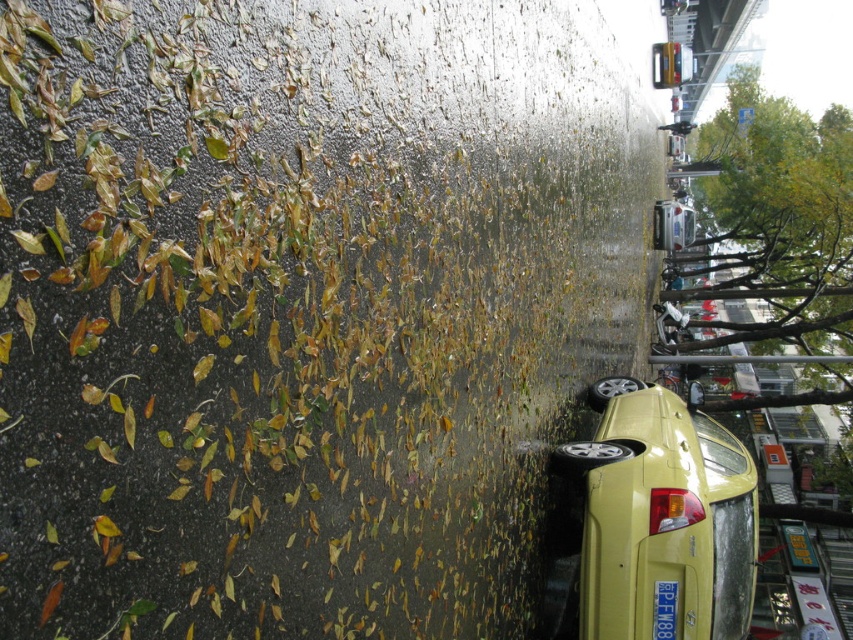
You are a delivery person trying to navigate through the wet leaves on the road. You see the yellow matte car at lower right and the yellow plastic license plate at lower right. Which object is closer to the left side of the road?

The yellow plastic license plate at lower right is closer to the left side of the road because the yellow matte car at lower right is positioned on the right side of it.

You are a delivery person trying to determine if your 1.8 meters long package can fit in the trunk of the yellow matte car at lower right. The trunk space is just enough to accommodate the package if there are no obstructions. However, there is a yellow plastic license plate at lower right inside the trunk. Can the package fit?

The yellow matte car at lower right is larger in size than the yellow plastic license plate at lower right. Since the license plate is inside the trunk, the trunk itself must be larger than the license plate. Therefore, the 1.8 meters long package can fit in the trunk of the yellow matte car at lower right as long as there are no other obstructions.

You are standing at the point marked by the coordinates point (x=663, y=516). Looking around, you see a yellow matte car at lower right. What is the nearest object to you?

The nearest object to you is the yellow matte car at lower right, as the point (x=663, y=516) marks its location.